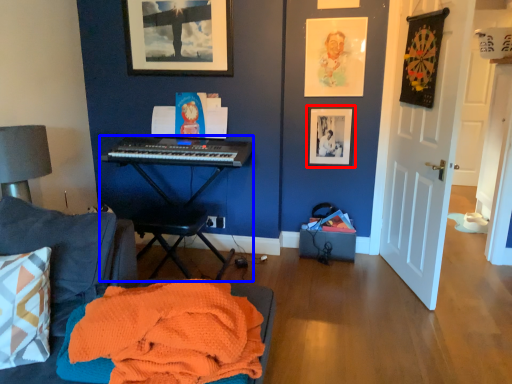
Question: Among these objects, which one is nearest to the camera, picture frame (highlighted by a red box) or piano (highlighted by a blue box)?

Choices:
 (A) picture frame
 (B) piano

Answer: (B)